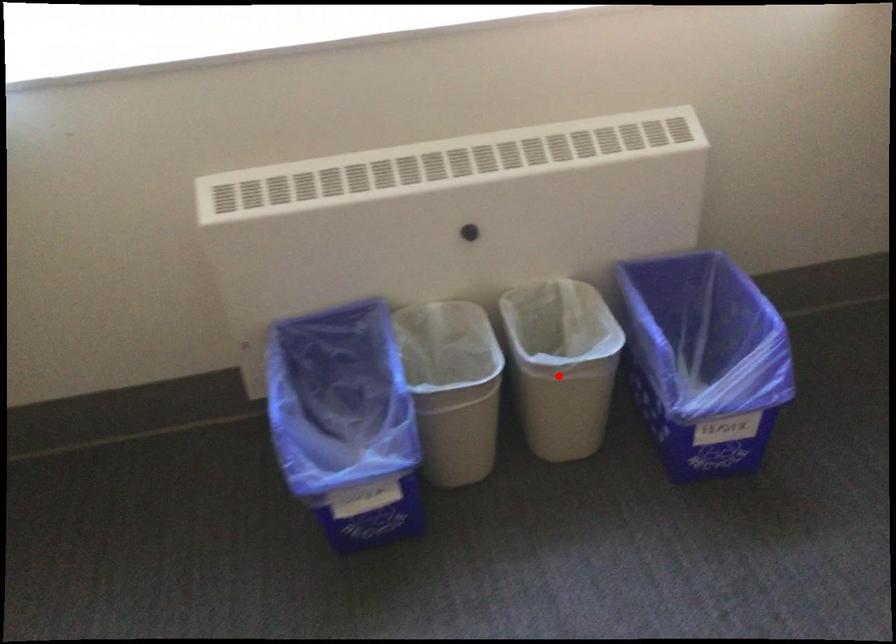
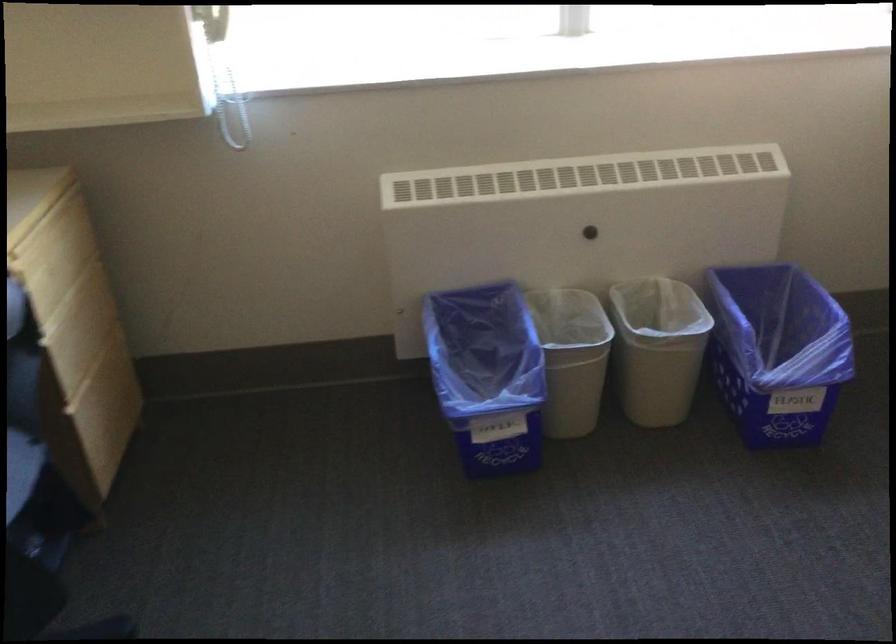
Question: A red point is marked in image1. In image2, is the corresponding 3D point closer to the camera or farther? Reply with the corresponding letter.

Choices:
 (A) The corresponding 3D point is closer.
 (B) The corresponding 3D point is farther.

Answer: (B)